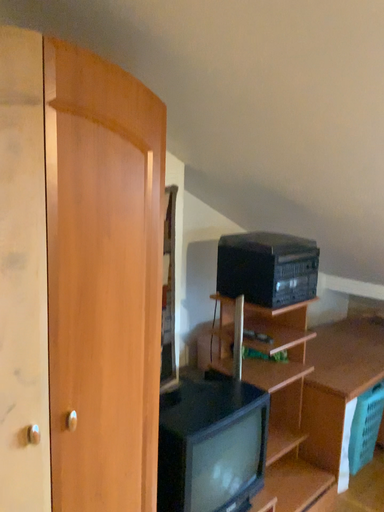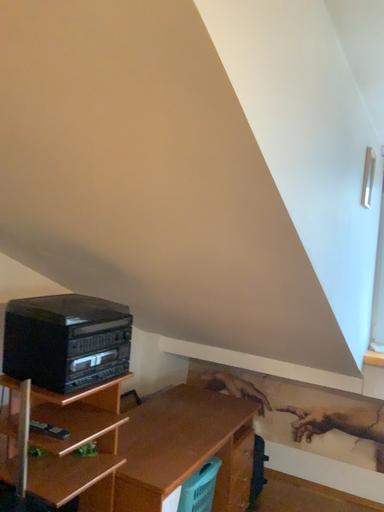
Question: Which way did the camera rotate in the video?

Choices:
 (A) rotated upward
 (B) rotated downward

Answer: (A)